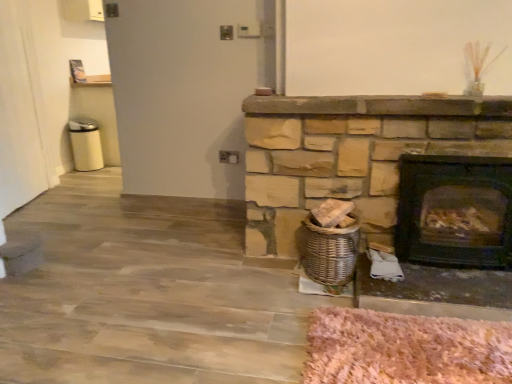
What is the approximate width of black matte wood burning stove at right?

The width of black matte wood burning stove at right is 29.77 centimeters.

Image resolution: width=512 pixels, height=384 pixels. Find the location of `black matte wood burning stove at right`. black matte wood burning stove at right is located at coordinates (455, 211).

Describe the element at coordinates (455, 211) in the screenshot. This screenshot has height=384, width=512. I see `black matte wood burning stove at right` at that location.

This screenshot has height=384, width=512. What are the coordinates of `woven brown basket at lower center` in the screenshot? It's located at (328, 251).

What is the approximate width of woven brown basket at lower center?

It is 12.11 inches.

In order to face woven brown basket at lower center, should I rotate leftwards or rightwards?

Rotate your view right by about 10.029°.

What do you see at coordinates (328, 251) in the screenshot? I see `woven brown basket at lower center` at bounding box center [328, 251].

Find the location of a particular element. The height and width of the screenshot is (384, 512). black matte wood burning stove at right is located at coordinates (455, 211).

Is black matte wood burning stove at right to the right of woven brown basket at lower center from the viewer's perspective?

Indeed, black matte wood burning stove at right is positioned on the right side of woven brown basket at lower center.

Considering their positions, is black matte wood burning stove at right located in front of or behind woven brown basket at lower center?

black matte wood burning stove at right is positioned closer to the viewer than woven brown basket at lower center.

Does point (467, 249) lie in front of point (316, 251)?

Yes.

In the scene shown: From the image's perspective, is black matte wood burning stove at right above or below woven brown basket at lower center?

Clearly, from the image's perspective, black matte wood burning stove at right is above woven brown basket at lower center.

From a real-world perspective, is black matte wood burning stove at right beneath woven brown basket at lower center?

No.

Which object is thinner, black matte wood burning stove at right or woven brown basket at lower center?

With smaller width is black matte wood burning stove at right.

Considering the sizes of objects black matte wood burning stove at right and woven brown basket at lower center in the image provided, who is taller, black matte wood burning stove at right or woven brown basket at lower center?

black matte wood burning stove at right is taller.

Considering the sizes of objects black matte wood burning stove at right and woven brown basket at lower center in the image provided, who is bigger, black matte wood burning stove at right or woven brown basket at lower center?

With larger size is black matte wood burning stove at right.

Would you say black matte wood burning stove at right is inside or outside woven brown basket at lower center?

black matte wood burning stove at right exists outside the volume of woven brown basket at lower center.

Is black matte wood burning stove at right next to woven brown basket at lower center and touching it?

No, black matte wood burning stove at right is not next to woven brown basket at lower center.

Could you tell me if black matte wood burning stove at right is turned towards woven brown basket at lower center?

No, black matte wood burning stove at right is not facing towards woven brown basket at lower center.

Where is `basket below the black matte wood burning stove at right (from a real-world perspective)`? The width and height of the screenshot is (512, 384). basket below the black matte wood burning stove at right (from a real-world perspective) is located at coordinates (328, 251).

Considering the relative positions of woven brown basket at lower center and black matte wood burning stove at right in the image provided, is woven brown basket at lower center to the right of black matte wood burning stove at right from the viewer's perspective?

No, woven brown basket at lower center is not to the right of black matte wood burning stove at right.

Which is behind, woven brown basket at lower center or black matte wood burning stove at right?

woven brown basket at lower center is behind.

Does point (307, 220) appear closer or farther from the camera than point (477, 242)?

Clearly, point (307, 220) is more distant from the camera than point (477, 242).

From the image's perspective, which is above, woven brown basket at lower center or black matte wood burning stove at right?

From the image's view, black matte wood burning stove at right is above.

From a real-world perspective, is woven brown basket at lower center positioned above or below black matte wood burning stove at right?

From a real-world perspective, woven brown basket at lower center is physically below black matte wood burning stove at right.

Which object is wider, woven brown basket at lower center or black matte wood burning stove at right?

With larger width is woven brown basket at lower center.

Can you confirm if woven brown basket at lower center is shorter than black matte wood burning stove at right?

Indeed, woven brown basket at lower center has a lesser height compared to black matte wood burning stove at right.

Is woven brown basket at lower center bigger or smaller than black matte wood burning stove at right?

In the image, woven brown basket at lower center appears to be smaller than black matte wood burning stove at right.

Could black matte wood burning stove at right be considered to be inside woven brown basket at lower center?

No, black matte wood burning stove at right is located outside of woven brown basket at lower center.

Is woven brown basket at lower center placed right next to black matte wood burning stove at right?

No.

Is woven brown basket at lower center looking in the opposite direction of black matte wood burning stove at right?

That's not correct — woven brown basket at lower center is not looking away from black matte wood burning stove at right.

Measure the distance from woven brown basket at lower center to black matte wood burning stove at right.

18.85 inches.

At what (x,y) coordinates should I click in order to perform the action: click on basket that is below the black matte wood burning stove at right (from the image's perspective). Please return your answer as a coordinate pair (x, y). Looking at the image, I should click on (328, 251).

The width and height of the screenshot is (512, 384). What are the coordinates of `wood burning stove above the woven brown basket at lower center (from a real-world perspective)` in the screenshot? It's located at (455, 211).

This screenshot has height=384, width=512. In order to click on basket lying on the left of black matte wood burning stove at right in this screenshot , I will do `click(328, 251)`.